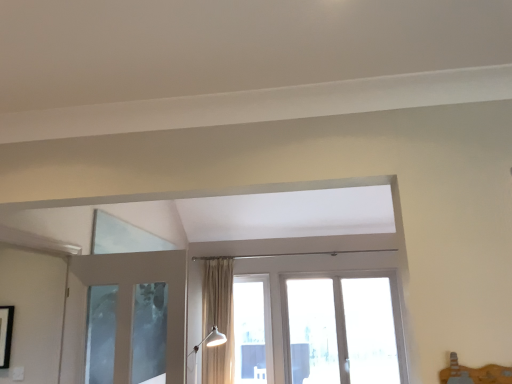
Question: From the image's perspective, is clear glass window at center below beige fabric curtain at center?

Choices:
 (A) no
 (B) yes

Answer: (B)

Question: Is clear glass window at center wider than beige fabric curtain at center?

Choices:
 (A) no
 (B) yes

Answer: (A)

Question: Can you confirm if clear glass window at center is smaller than beige fabric curtain at center?

Choices:
 (A) no
 (B) yes

Answer: (B)

Question: From the image's perspective, is clear glass window at center on beige fabric curtain at center?

Choices:
 (A) no
 (B) yes

Answer: (A)

Question: Is clear glass window at center thinner than beige fabric curtain at center?

Choices:
 (A) yes
 (B) no

Answer: (A)

Question: Considering their positions, is beige fabric curtain at center located in front of or behind white glossy floor lamp at lower center?

Choices:
 (A) behind
 (B) front

Answer: (A)

Question: Considering the positions of point (216, 271) and point (211, 334), is point (216, 271) closer or farther from the camera than point (211, 334)?

Choices:
 (A) closer
 (B) farther

Answer: (B)

Question: Is beige fabric curtain at center to the left or to the right of white glossy floor lamp at lower center in the image?

Choices:
 (A) left
 (B) right

Answer: (B)

Question: In terms of width, does beige fabric curtain at center look wider or thinner when compared to white glossy floor lamp at lower center?

Choices:
 (A) thin
 (B) wide

Answer: (A)

Question: Considering the positions of beige fabric curtain at center and clear glass window at center in the image, is beige fabric curtain at center wider or thinner than clear glass window at center?

Choices:
 (A) thin
 (B) wide

Answer: (B)

Question: Is point (226, 301) closer or farther from the camera than point (243, 297)?

Choices:
 (A) farther
 (B) closer

Answer: (B)

Question: From their relative heights in the image, would you say beige fabric curtain at center is taller or shorter than clear glass window at center?

Choices:
 (A) short
 (B) tall

Answer: (B)

Question: From a real-world perspective, is beige fabric curtain at center physically located above or below clear glass window at center?

Choices:
 (A) below
 (B) above

Answer: (B)

Question: From a real-world perspective, is white glossy floor lamp at lower center positioned above or below beige fabric curtain at center?

Choices:
 (A) above
 (B) below

Answer: (B)

Question: Relative to beige fabric curtain at center, is white glossy floor lamp at lower center in front or behind?

Choices:
 (A) front
 (B) behind

Answer: (A)